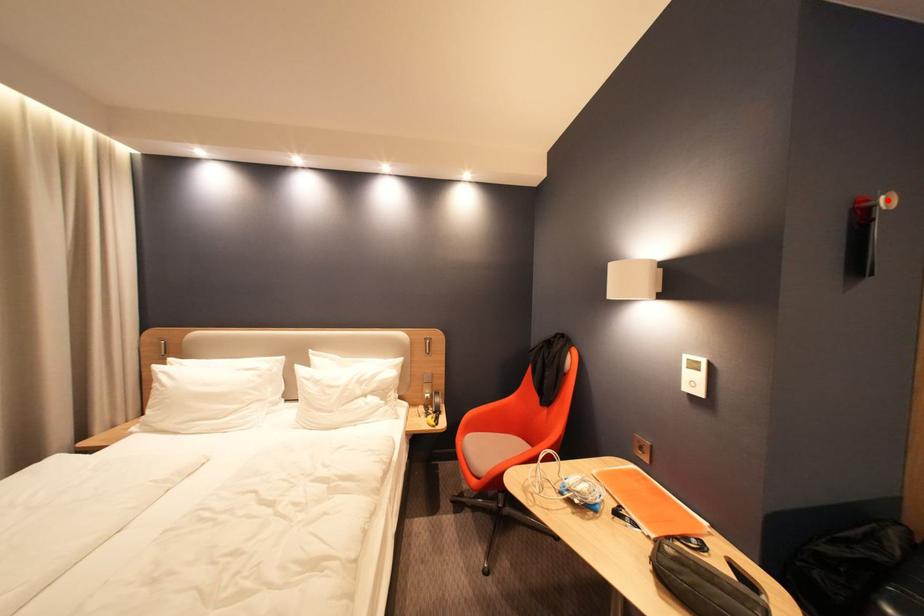
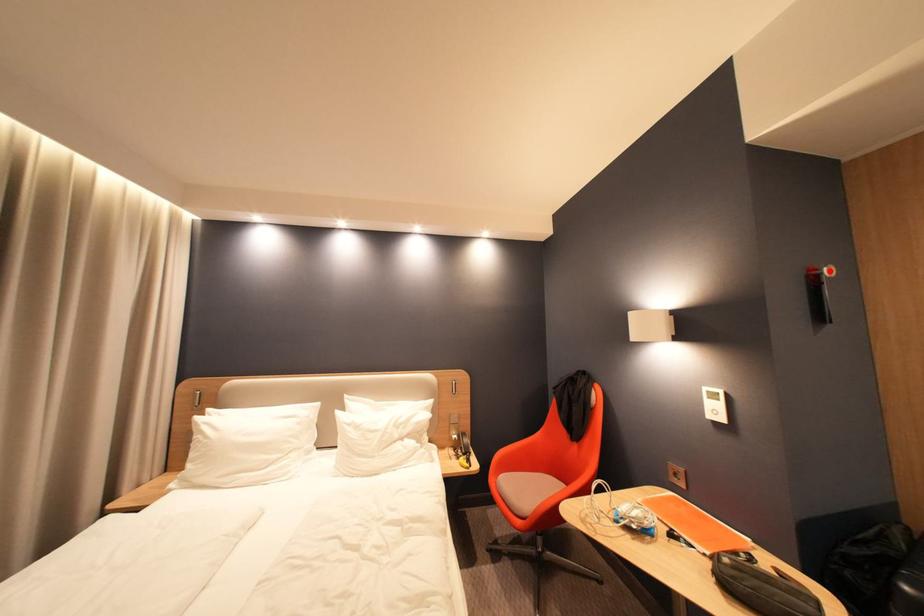
I am providing you with two images of the same scene from different viewpoints. A red point is marked on the first image and another point is marked on the second image. Do the highlighted points in image1 and image2 indicate the same real-world spot?

Yes